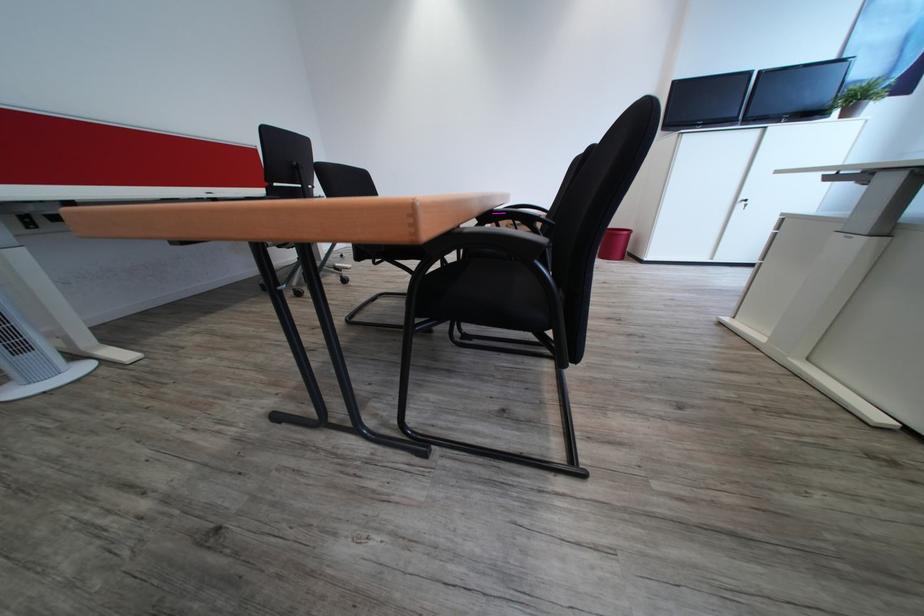
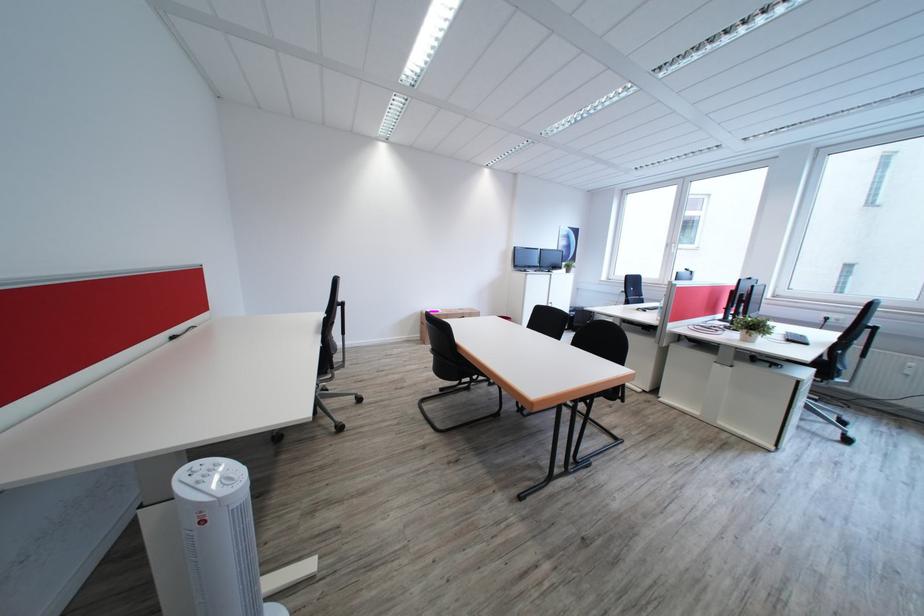
Question: I am providing you with two images of the same scene from different viewpoints. Which of the following objects are not visible in image2?

Choices:
 (A) small plant pot
 (B) white hanging container
 (C) black chair sitting surface
 (D) chair sitting surface

Answer: (C)